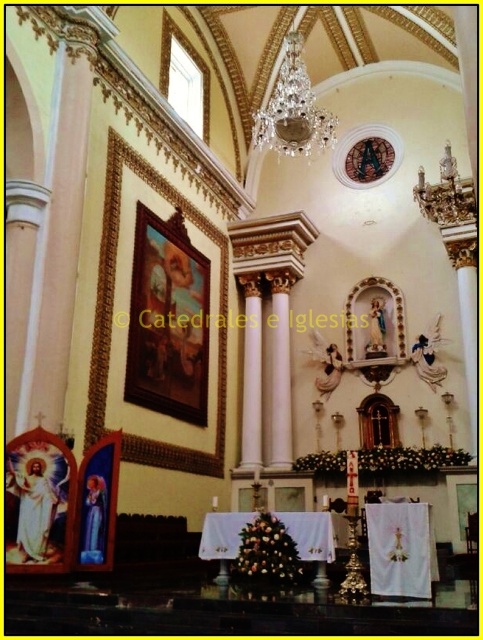
Question: Observing the image, what is the correct spatial positioning of wooden framed painting at upper left in reference to crystal glass chandelier at upper center?

Choices:
 (A) above
 (B) below

Answer: (B)

Question: Can you confirm if wooden framed painting at upper left is positioned below crystal glass chandelier at upper center?

Choices:
 (A) no
 (B) yes

Answer: (B)

Question: Does wooden framed painting at upper left have a larger size compared to crystal glass chandelier at upper center?

Choices:
 (A) no
 (B) yes

Answer: (A)